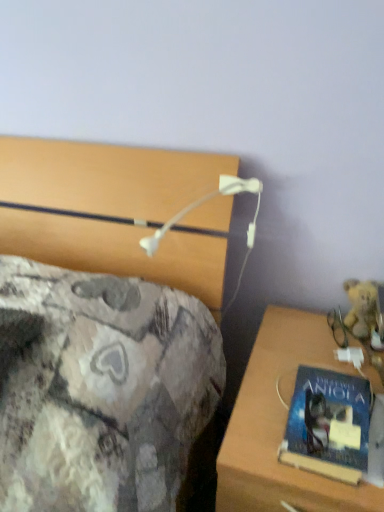
Question: Considering their positions, is fuzzy yellow teddy bear at right located in front of or behind wooden desk at lower right?

Choices:
 (A) behind
 (B) front

Answer: (A)

Question: In terms of height, does fuzzy yellow teddy bear at right look taller or shorter compared to wooden desk at lower right?

Choices:
 (A) tall
 (B) short

Answer: (B)

Question: Which is nearer to the blue matte book at right?

Choices:
 (A) wooden desk at lower right
 (B) fuzzy yellow teddy bear at right

Answer: (A)

Question: Based on their relative distances, which object is farther from the blue matte book at right?

Choices:
 (A) fuzzy yellow teddy bear at right
 (B) wooden desk at lower right

Answer: (A)